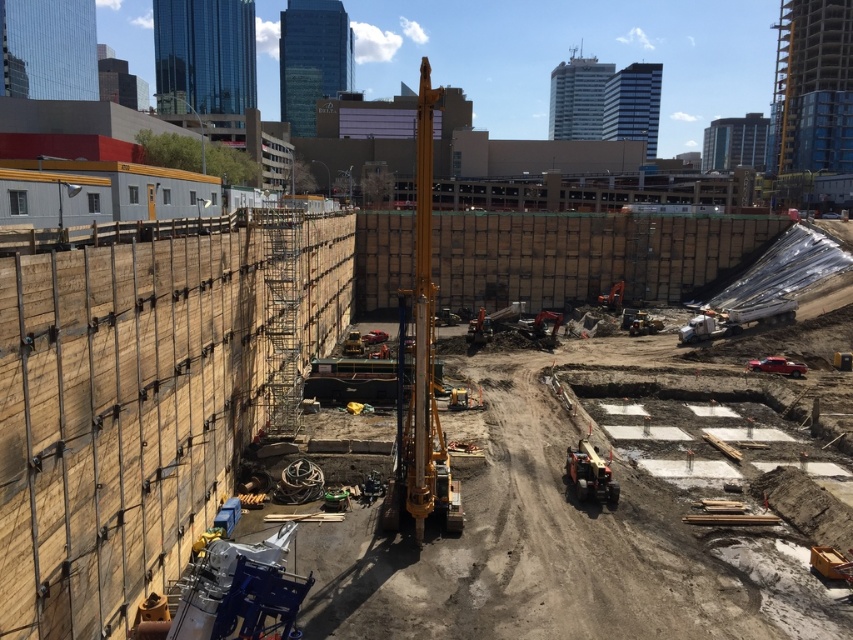
You are a construction worker standing at the edge of the excavation area. You need to locate the yellow metallic drilling rig at center. According to the coordinates provided, where exactly should you look within the excavation area?

The yellow metallic drilling rig at center is located at point coordinates (421, 362) within the excavation area.

You are a construction worker standing at the edge of the excavation area. You need to move a heavy load from the ground level to the bottom of the excavation. Which equipment should you use, the yellow metallic drilling rig at center or the metallic yellow crane at center?

The metallic yellow crane at center should be used to move the heavy load since it is positioned further away from the viewer, meaning it has a better reach into the excavation area compared to the closer yellow metallic drilling rig at center.

Consider the image. You are an inspector standing at the edge of the excavation site. You need to determine if the yellow metallic drilling rig at center can be safely lowered down into the excavation pit without hitting the metallic yellow crane at center. Based on their positions, is this possible?

The yellow metallic drilling rig at center is above the metallic yellow crane at center, so it can be safely lowered down without hitting the crane as long as it is aligned properly.